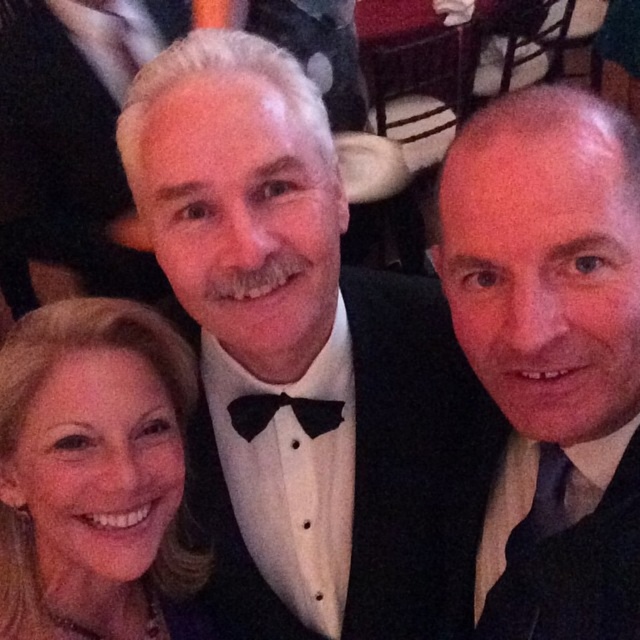
You are a photographer trying to adjust the lighting for a portrait. You notice the black satin suit at center and the black satin bow tie at center in the frame. Which object is positioned lower in the image?

The black satin suit at center is located below the black satin bow tie at center, so the black satin suit at center is positioned lower in the image.

You are a photographer standing 30 inches away from the scene. You want to adjust your position to focus on the blonde hair at lower left. Do you need to move closer or farther away?

The blonde hair at lower left is 29.29 inches away from viewer. Since you are currently 30 inches away, you need to move slightly closer to be within the 29.29 inches distance to focus properly.

You are a photographer trying to adjust the lighting for a group photo. You notice the blonde hair at lower left and the black satin bow tie at center. Which object is located more to the left side of the image?

The blonde hair at lower left is more to the left side of the image.